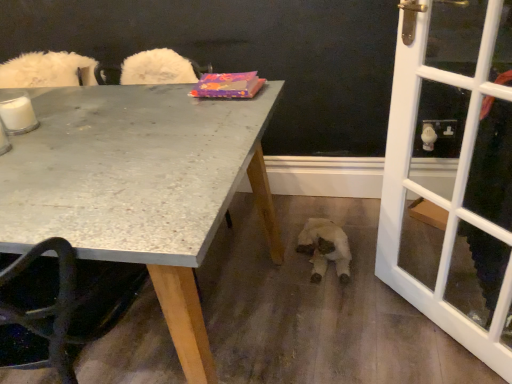
Question: Is white glass screen door at right situated inside granite gray table at upper left or outside?

Choices:
 (A) outside
 (B) inside

Answer: (A)

Question: Considering the relative positions of white glass screen door at right and granite gray table at upper left in the image provided, is white glass screen door at right to the left or to the right of granite gray table at upper left?

Choices:
 (A) left
 (B) right

Answer: (B)

Question: Which object is positioned closest to the white glass screen door at right?

Choices:
 (A) white plush toy at lower center
 (B) granite gray table at upper left

Answer: (A)

Question: Estimate the real-world distances between objects in this image. Which object is farther from the granite gray table at upper left?

Choices:
 (A) white glass screen door at right
 (B) white plush toy at lower center

Answer: (B)